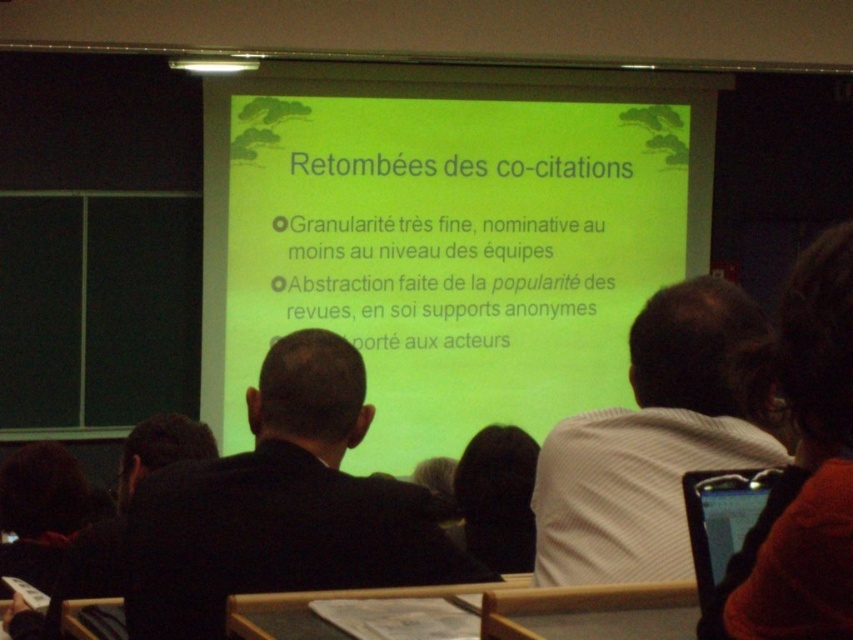
Does black suit at center appear under white striped shirt at right?

Correct, black suit at center is located below white striped shirt at right.

Locate an element on the screen. The height and width of the screenshot is (640, 853). black suit at center is located at coordinates (281, 506).

Where is `black suit at center`? This screenshot has width=853, height=640. black suit at center is located at coordinates tap(281, 506).

Does white striped shirt at right appear on the right side of matte black phone at lower right?

Incorrect, white striped shirt at right is not on the right side of matte black phone at lower right.

Does white striped shirt at right have a larger size compared to matte black phone at lower right?

Correct, white striped shirt at right is larger in size than matte black phone at lower right.

Image resolution: width=853 pixels, height=640 pixels. Find the location of `white striped shirt at right`. white striped shirt at right is located at coordinates (650, 444).

Is black suit at center positioned at the back of matte black phone at lower right?

Yes, black suit at center is behind matte black phone at lower right.

Does point (302, 397) come behind point (726, 518)?

Yes, point (302, 397) is farther from viewer.

Where is `black suit at center`? The height and width of the screenshot is (640, 853). black suit at center is located at coordinates (281, 506).